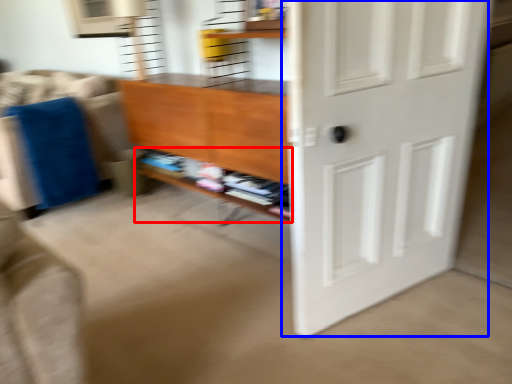
Question: Which object appears farthest to the camera in this image, shelf (highlighted by a red box) or door (highlighted by a blue box)?

Choices:
 (A) shelf
 (B) door

Answer: (A)